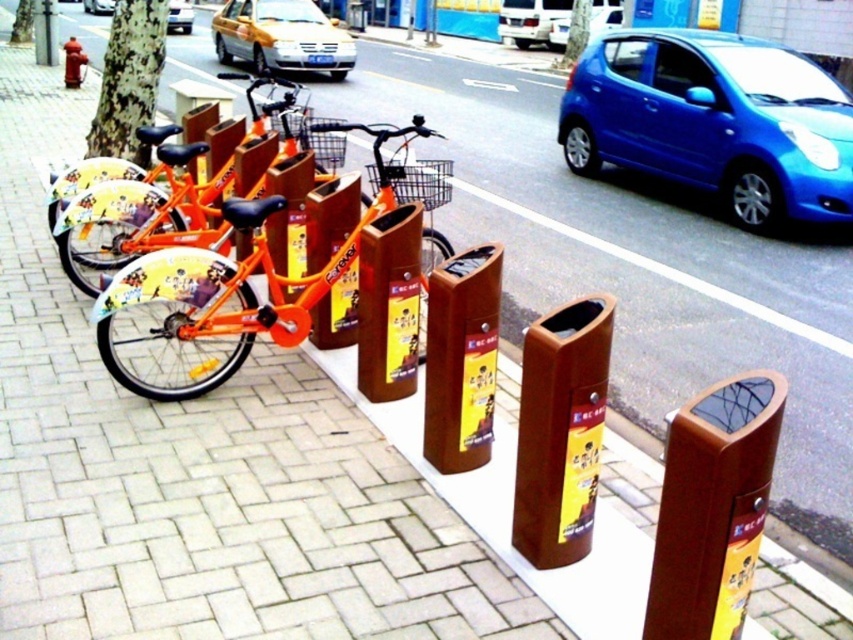
You are a delivery person needing to load a 4.5 meter long ladder into your vehicle. You are standing near the orange matte bicycle at left and your vehicle is the blue glossy hatchback at upper right. Can you safely load the ladder into your vehicle without moving any other objects?

The distance between the orange matte bicycle at left and the blue glossy hatchback at upper right is 4.41 meters. Since the ladder is 4.5 meters long, it is slightly longer than the available space. Therefore, you cannot safely load the ladder without moving other objects to create more space.

Based on the photo, you are a delivery person trying to park your 1.2 meter wide cart between the wooden trash can at center and the metallic silver car at upper center. Based on the scene, can your cart fit in the space between them?

The wooden trash can at center has a smaller size compared to metallic silver car at upper center. However, the exact distance between them isn not specified. Without knowing the actual space between the two objects, it is impossible to determine if the cart will fit.